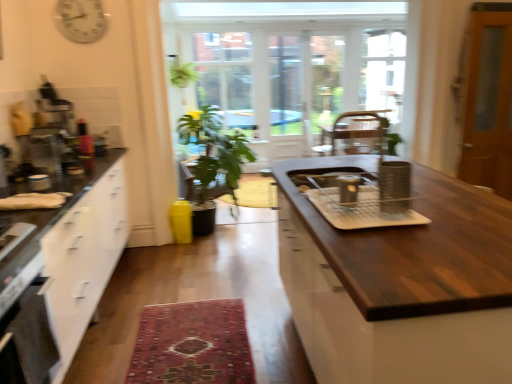
Question: Which direction should I rotate to face clear glass tray at center, the first appliance viewed from the front, — up or down?

Choices:
 (A) down
 (B) up

Answer: (A)

Question: Is green matte plant at center aimed at metallic silver container at center, the 5th appliance when ordered from left to right?

Choices:
 (A) no
 (B) yes

Answer: (A)

Question: Can you confirm if green matte plant at center is bigger than metallic silver container at center, arranged as the 1th appliance when viewed from the right?

Choices:
 (A) yes
 (B) no

Answer: (A)

Question: From a real-world perspective, is green matte plant at center positioned over metallic silver container at center, arranged as the 1th appliance when viewed from the right, based on gravity?

Choices:
 (A) no
 (B) yes

Answer: (A)

Question: Can you confirm if green matte plant at center is thinner than metallic silver container at center, arranged as the 1th appliance when viewed from the right?

Choices:
 (A) yes
 (B) no

Answer: (B)

Question: Is green matte plant at center next to metallic silver container at center, arranged as the 1th appliance when viewed from the right, and touching it?

Choices:
 (A) yes
 (B) no

Answer: (B)

Question: Is green matte plant at center wider than metallic silver container at center, the second appliance from the front?

Choices:
 (A) yes
 (B) no

Answer: (A)

Question: Is black matte oven at lower left completely or partially inside clear glass tray at center, which is counted as the 4th appliance, starting from the left?

Choices:
 (A) yes
 (B) no

Answer: (B)

Question: Is clear glass tray at center, placed as the 5th appliance when sorted from back to front, positioned far away from black matte oven at lower left?

Choices:
 (A) no
 (B) yes

Answer: (B)

Question: Is clear glass tray at center, which is the second appliance from right to left, to the left of black matte oven at lower left from the viewer's perspective?

Choices:
 (A) no
 (B) yes

Answer: (A)

Question: Is clear glass tray at center, which is counted as the 4th appliance, starting from the left, oriented away from black matte oven at lower left?

Choices:
 (A) no
 (B) yes

Answer: (A)

Question: Is clear glass tray at center, placed as the 5th appliance when sorted from back to front, positioned behind black matte oven at lower left?

Choices:
 (A) no
 (B) yes

Answer: (B)

Question: Can you confirm if clear glass tray at center, which is the second appliance from right to left, is wider than black matte oven at lower left?

Choices:
 (A) yes
 (B) no

Answer: (A)

Question: Considering the relative positions of dark wood countertop at center and green matte plant at center in the image provided, is dark wood countertop at center behind green matte plant at center?

Choices:
 (A) no
 (B) yes

Answer: (A)